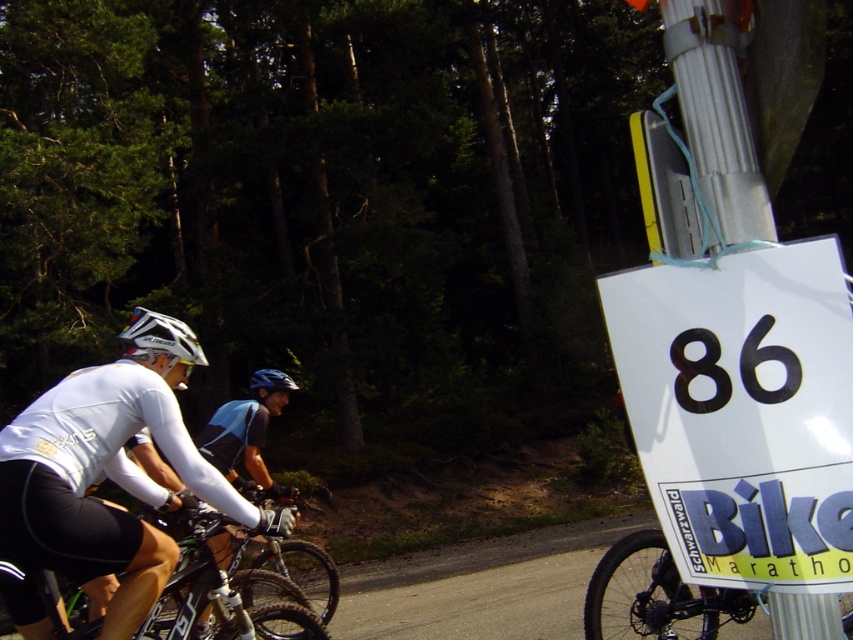
Question: Which of the following is the closest to the observer?

Choices:
 (A) green matte bicycle at center
 (B) silver metallic pole at right
 (C) blackmaterial/texturenumber at right
 (D) white matte helmet at upper left

Answer: (B)

Question: Can you confirm if silver metallic pole at right is thinner than green matte bicycle at center?

Choices:
 (A) no
 (B) yes

Answer: (B)

Question: Which point appears farthest from the camera in this image?

Choices:
 (A) (701, 333)
 (B) (4, 572)
 (C) (708, 48)

Answer: (B)

Question: Can you confirm if silver metallic pole at right is positioned to the left of shiny blue helmet at center?

Choices:
 (A) yes
 (B) no

Answer: (B)

Question: Among these objects, which one is nearest to the camera?

Choices:
 (A) white matte helmet at upper left
 (B) silver metallic bicycle at right
 (C) blackmaterial/texturenumber at right

Answer: (C)

Question: Can you confirm if blackmaterial/texturenumber at right is wider than shiny blue helmet at center?

Choices:
 (A) no
 (B) yes

Answer: (A)